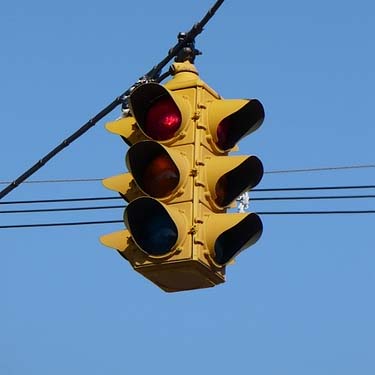
I want to click on cord, so click(x=89, y=124).